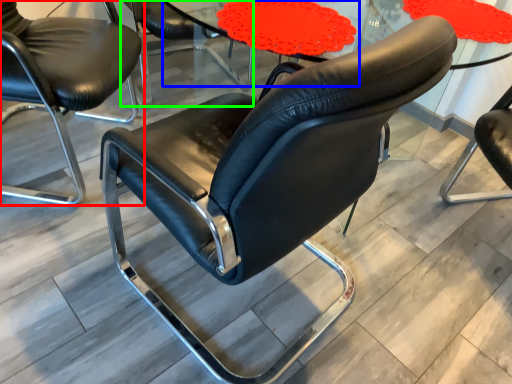
Question: Which object is the closest to the chair (highlighted by a red box)? Choose among these: round table (highlighted by a blue box) or chair (highlighted by a green box).

Choices:
 (A) round table
 (B) chair

Answer: (B)